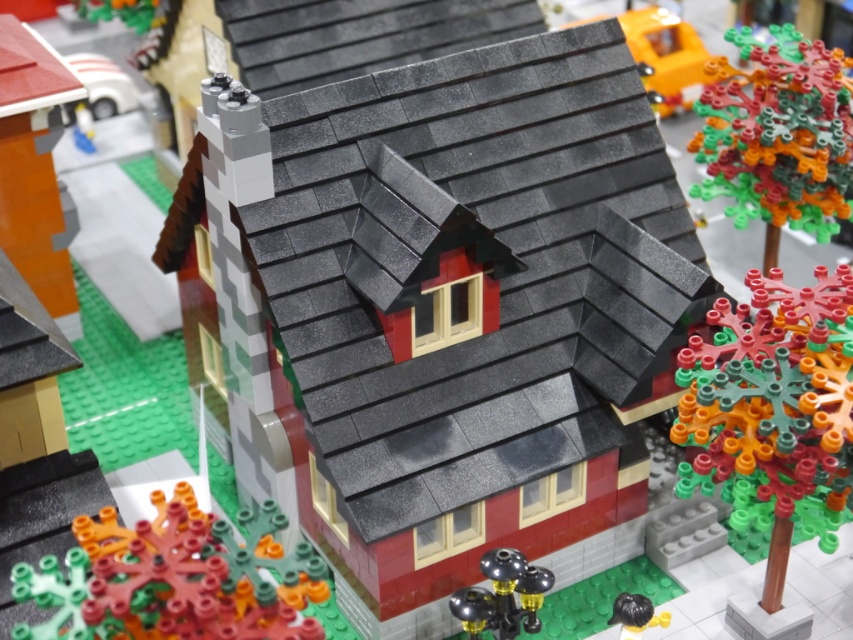
Consider the image. Does multicolored plastic tree at right have a larger size compared to metallic silver lamp post at lower center?

Yes, multicolored plastic tree at right is bigger than metallic silver lamp post at lower center.

Who is more forward, [730,525] or [537,604]?

Point [537,604] is more forward.

Identify the location of multicolored plastic tree at right. (773, 412).

Where is `multicolored plastic tree at right`? The width and height of the screenshot is (853, 640). multicolored plastic tree at right is located at coordinates (773, 412).

Consider the image. Who is positioned more to the right, translucent orange coral at lower left or multicolored plastic tree at upper right?

multicolored plastic tree at upper right is more to the right.

In the scene shown: Who is more distant from viewer, (138,593) or (776,49)?

The point (776,49) is more distant.

Between point (163, 525) and point (807, 230), which one is positioned in front?

Point (163, 525) is in front.

The width and height of the screenshot is (853, 640). In order to click on translucent orange coral at lower left in this screenshot , I will do `click(173, 579)`.

Between multicolored plastic tree at upper right and black rubber hair at lower right, which one is positioned higher?

multicolored plastic tree at upper right

Is multicolored plastic tree at upper right positioned at the back of black rubber hair at lower right?

Yes, it is behind black rubber hair at lower right.

Between point (833, 182) and point (633, 627), which one is positioned in front?

Point (633, 627) is more forward.

Identify the location of multicolored plastic tree at upper right. The image size is (853, 640). (778, 134).